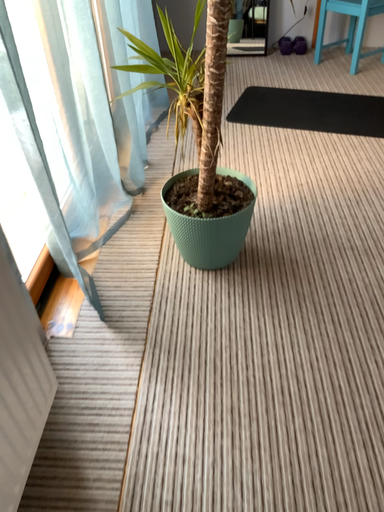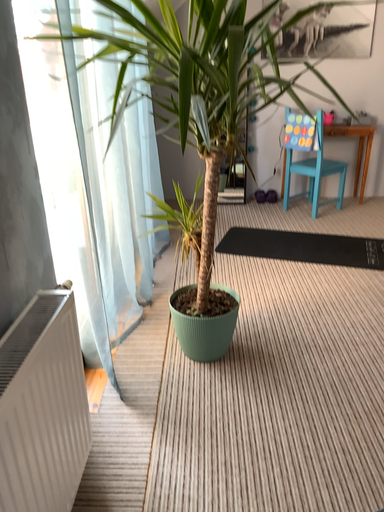
Question: How did the camera likely rotate when shooting the video?

Choices:
 (A) rotated upward
 (B) rotated downward

Answer: (A)